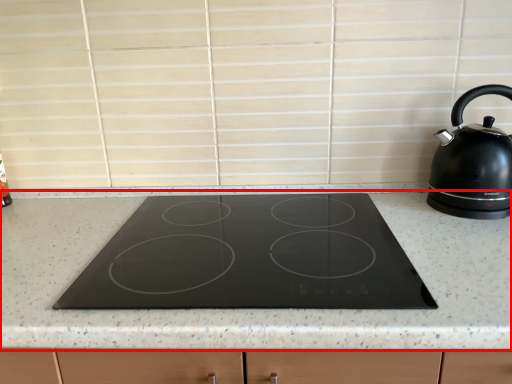
Question: From the image's perspective, where is countertop (annotated by the red box) located relative to kettle?

Choices:
 (A) above
 (B) below

Answer: (B)